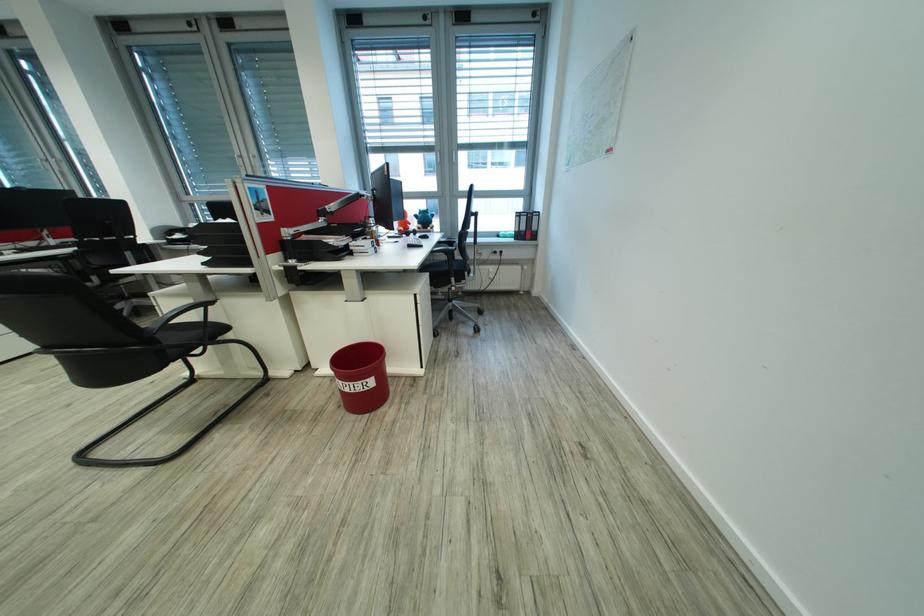
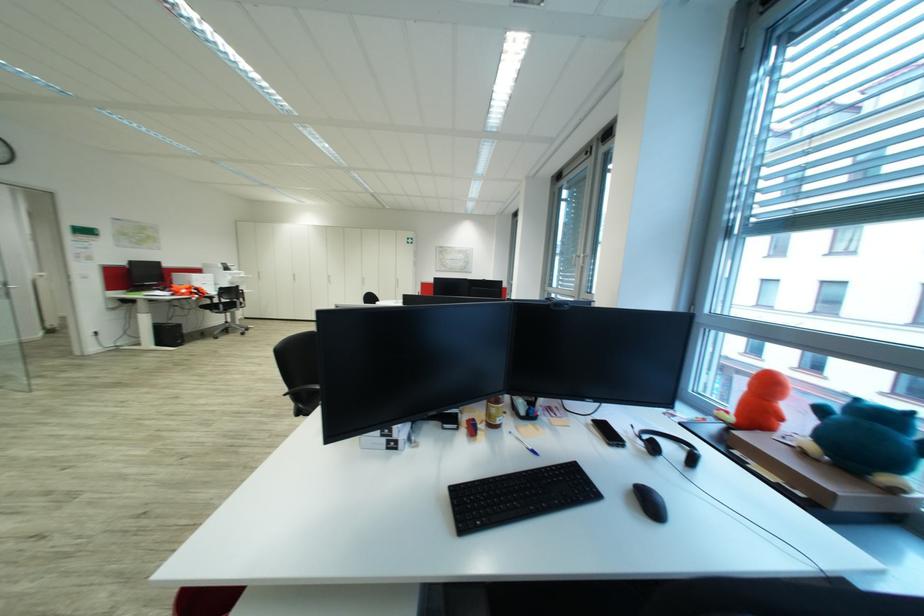
The point at [415,216] is marked in the first image. Where is the corresponding point in the second image?

(821, 410)